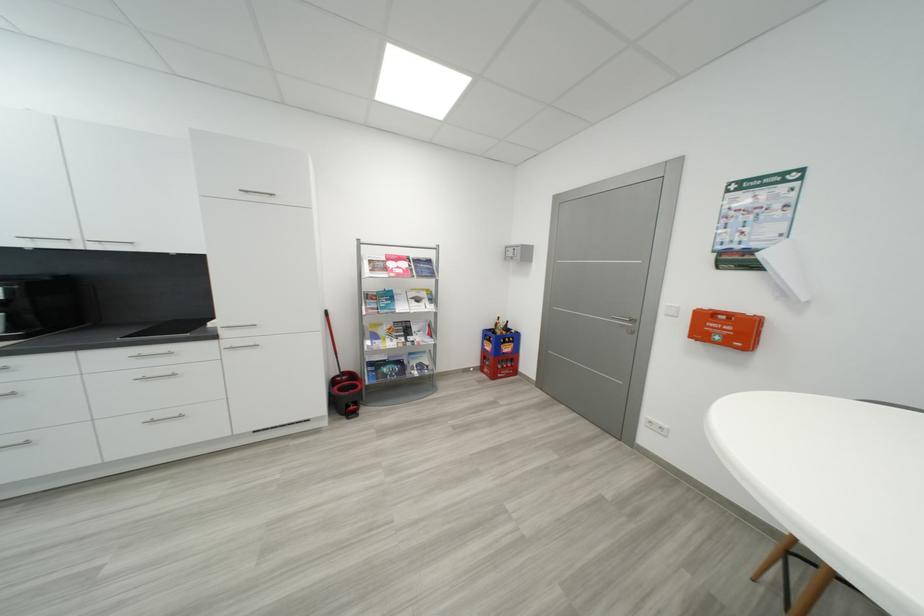
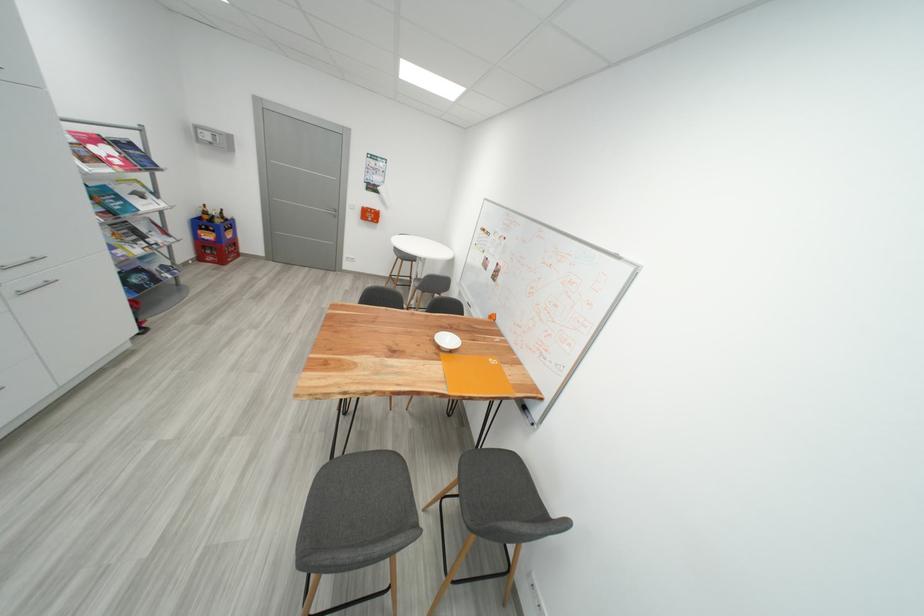
Find the pixel in the second image that matches point 393,270 in the first image.

(104, 161)